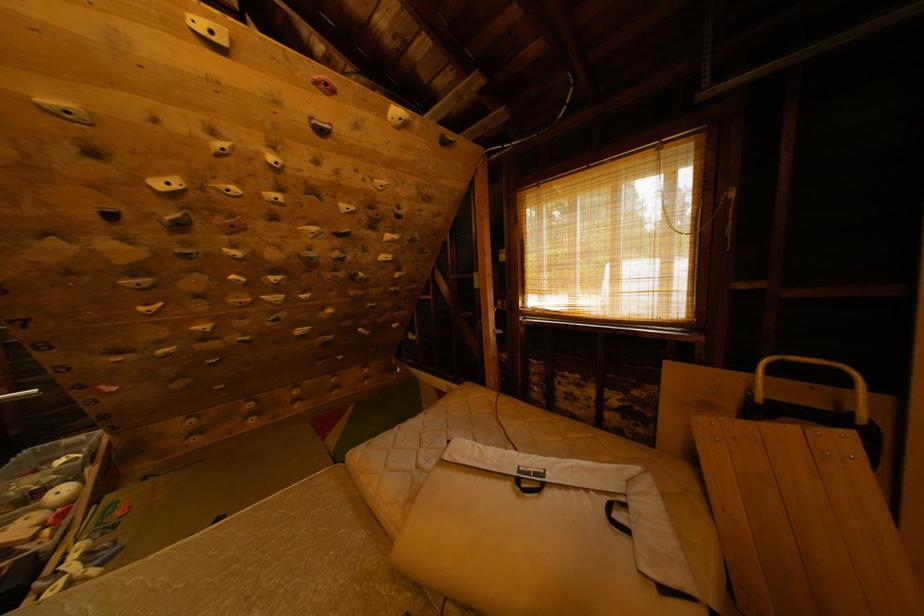
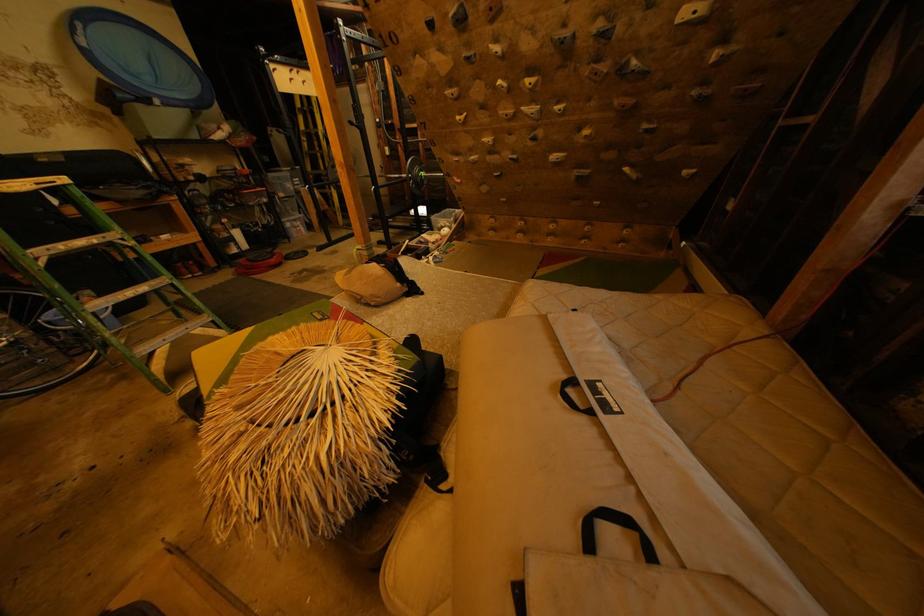
First-person continuous shooting, in which direction is the camera rotating?

The camera rotated toward left-down.